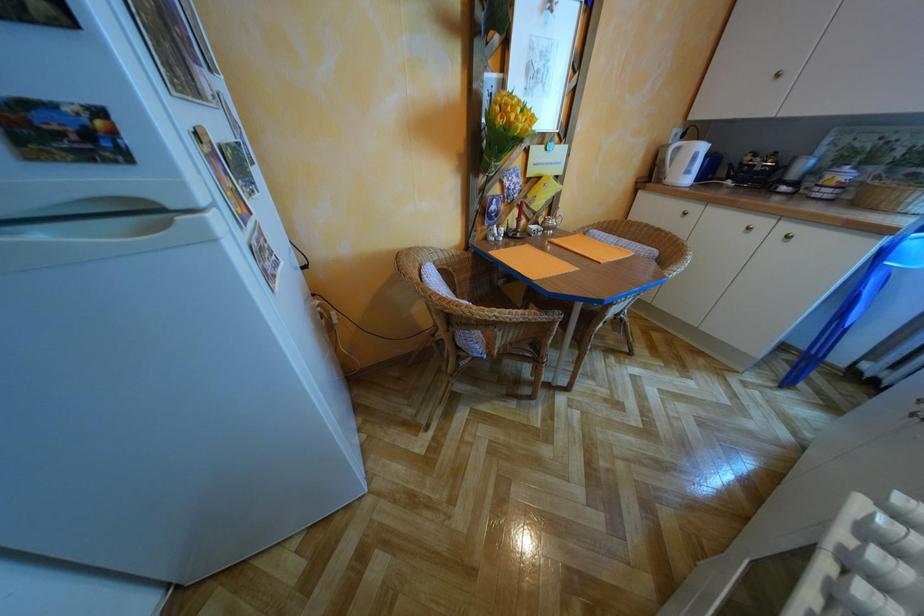
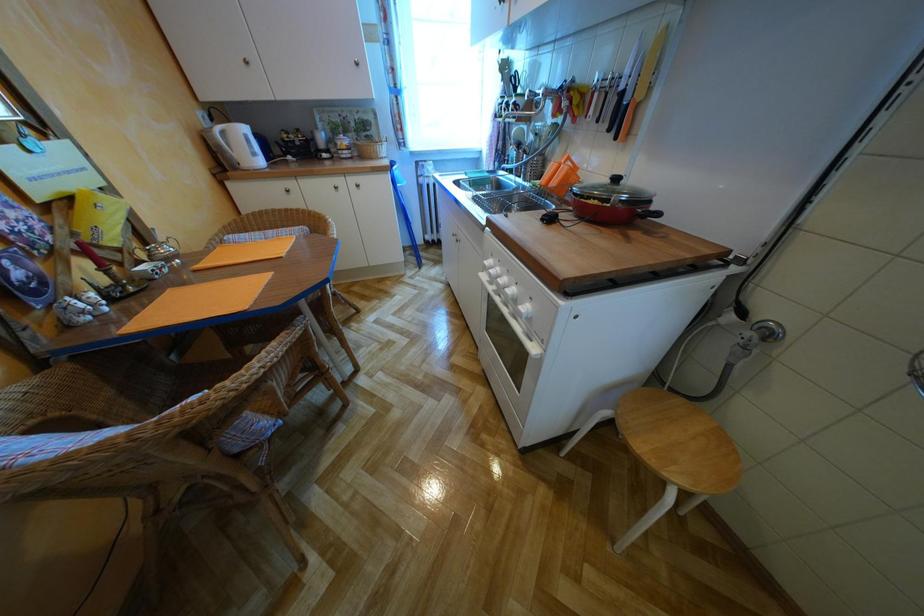
First-person continuous shooting, in which direction is the camera rotating?

The camera rotated toward right-down.